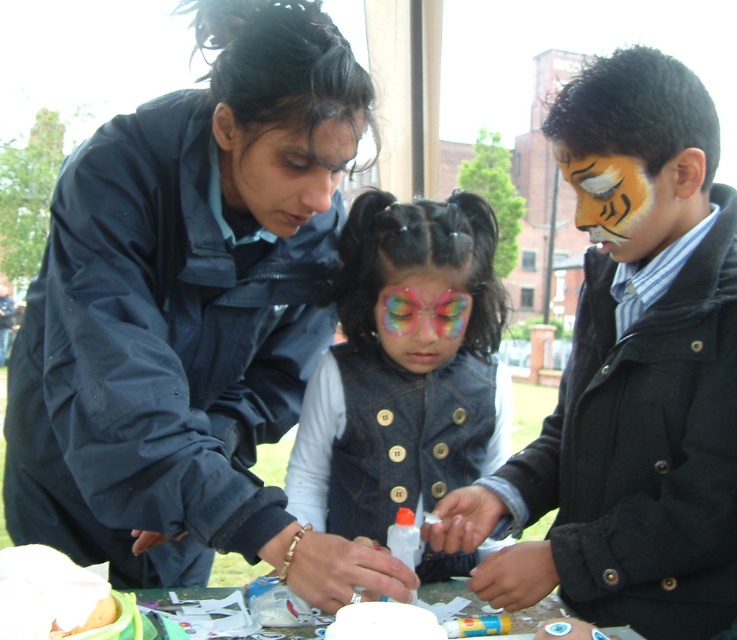
Question: Which point is closer to the camera?

Choices:
 (A) glittery rainbow face paint at center
 (B) matte black jacket at center
 (C) matte blue jacket at center

Answer: (C)

Question: Which of these objects is positioned farthest from the matte black hair at center?

Choices:
 (A) matte orange tiger face paint at center
 (B) glittery rainbow face paint at center

Answer: (A)

Question: Is matte black jacket at center smaller than denim vest at center?

Choices:
 (A) no
 (B) yes

Answer: (A)

Question: Can you confirm if matte black hair at center is positioned above glittery rainbow face paint at center?

Choices:
 (A) no
 (B) yes

Answer: (B)

Question: Can you confirm if matte orange tiger face paint at center is positioned above glittery rainbow face paint at center?

Choices:
 (A) yes
 (B) no

Answer: (A)

Question: Which of the following is the farthest from the observer?

Choices:
 (A) matte orange tiger face paint at center
 (B) matte blue jacket at center
 (C) glittery rainbow face paint at center
 (D) denim vest at center

Answer: (D)